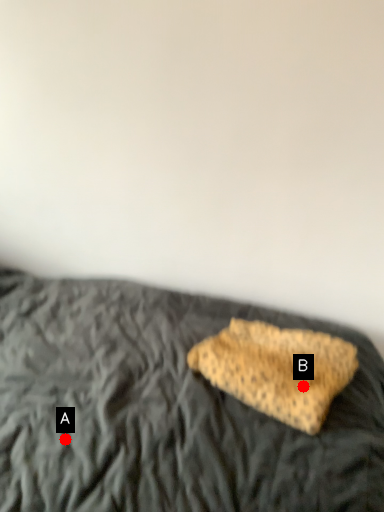
Question: Two points are circled on the image, labeled by A and B beside each circle. Which of the following is the farthest from the observer?

Choices:
 (A) A is further
 (B) B is further

Answer: (B)